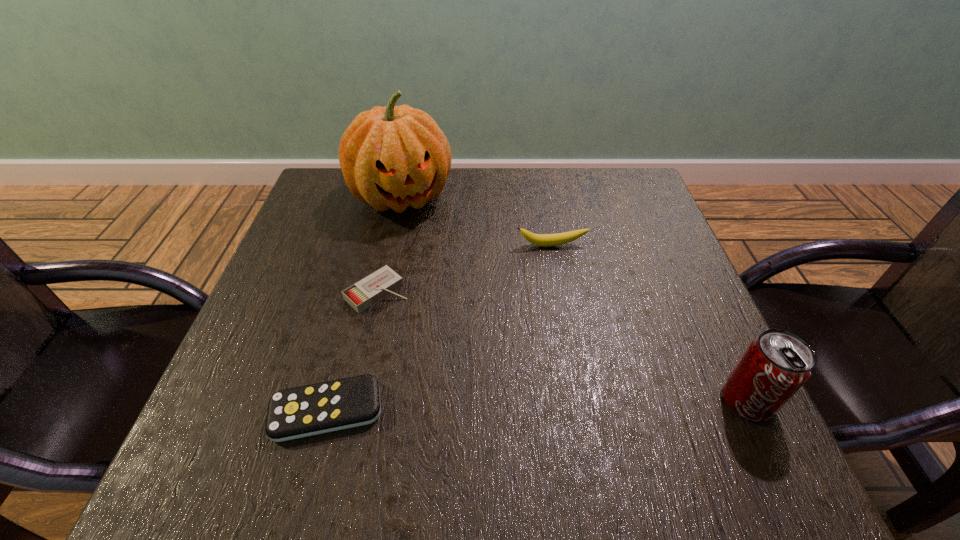
Identify the location of free space on the desktop that is between the shortest object and the rightmost object and is positioned on the carved face of the pumpkin. (499, 406).

Where is `vacant spot on the desktop that is between the remote control and the fourth shortest object and is positioned on the striking surface of the matchbox`? This screenshot has width=960, height=540. vacant spot on the desktop that is between the remote control and the fourth shortest object and is positioned on the striking surface of the matchbox is located at coordinates (506, 406).

At what (x,y) coordinates should I click in order to perform the action: click on free spot on the desktop that is between the shortest object and the pop soda and is positioned on the upward curve of the fourth nearest object. Please return your answer as a coordinate pair (x, y). Image resolution: width=960 pixels, height=540 pixels. Looking at the image, I should click on (593, 404).